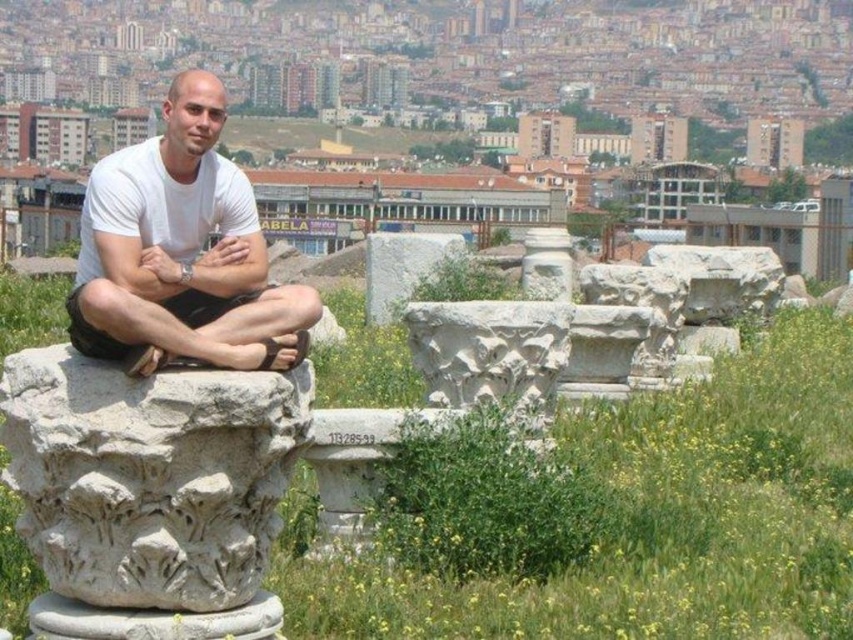
Question: Which of the following is the farthest from the observer?

Choices:
 (A) (109, 346)
 (B) (265, 554)

Answer: (B)

Question: Observing the image, what is the correct spatial positioning of white stone column at center in reference to white matte t-shirt at center?

Choices:
 (A) right
 (B) left

Answer: (A)

Question: Is white stone column at center further to the viewer compared to white matte t-shirt at center?

Choices:
 (A) no
 (B) yes

Answer: (A)

Question: Does white stone column at center appear under white matte t-shirt at center?

Choices:
 (A) no
 (B) yes

Answer: (B)